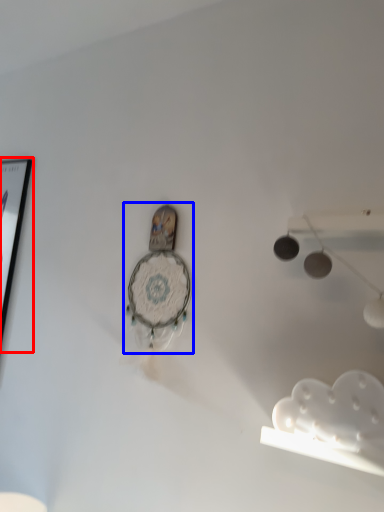
Question: Among these objects, which one is nearest to the camera, picture frame (highlighted by a red box) or clock (highlighted by a blue box)?

Choices:
 (A) picture frame
 (B) clock

Answer: (B)